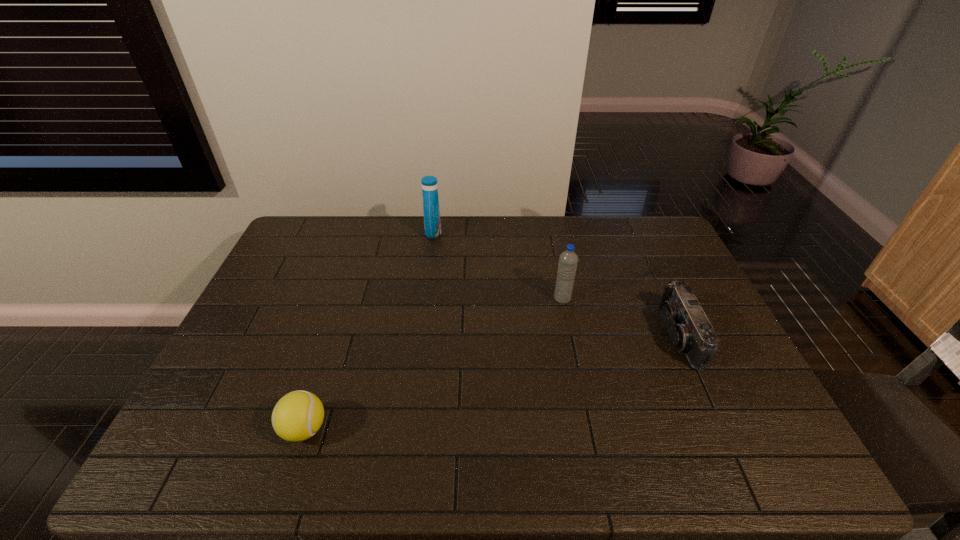
Locate an element on the screen. This screenshot has width=960, height=540. free space located on the front-facing side of the rightmost object is located at coordinates (568, 336).

Find the location of a particular element. This screenshot has height=540, width=960. free space located on the back of the nearest object is located at coordinates 321,381.

I want to click on object that is at the far edge, so click(432, 223).

At what (x,y) coordinates should I click in order to perform the action: click on object at the near edge. Please return your answer as a coordinate pair (x, y). The image size is (960, 540). Looking at the image, I should click on (297, 416).

Where is `object present at the right edge`? The image size is (960, 540). object present at the right edge is located at coordinates (689, 329).

Locate an element on the screen. The image size is (960, 540). vacant space at the far edge of the desktop is located at coordinates (519, 229).

The height and width of the screenshot is (540, 960). I want to click on vacant area at the left edge of the desktop, so click(x=251, y=389).

In the image, there is a desktop. Identify the location of free space at the right edge. (715, 424).

Image resolution: width=960 pixels, height=540 pixels. Find the location of `vacant space at the near left corner of the desktop`. vacant space at the near left corner of the desktop is located at coordinates pos(180,455).

The height and width of the screenshot is (540, 960). I want to click on free space at the far right corner, so click(663, 234).